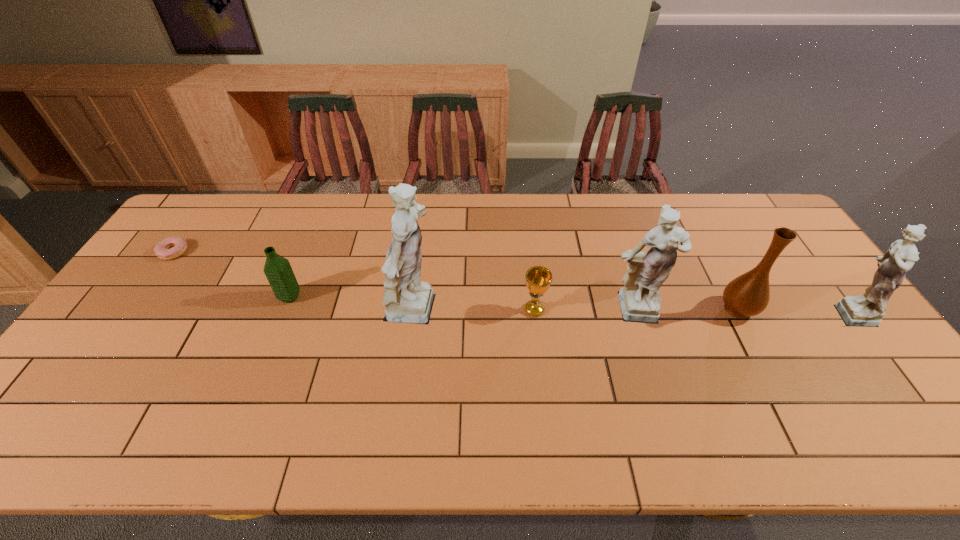
Locate an element on the screen. the second shortest object is located at coordinates (538, 278).

At what (x,y) coordinates should I click in order to perform the action: click on the fourth object from right to left. Please return your answer as a coordinate pair (x, y). The width and height of the screenshot is (960, 540). Looking at the image, I should click on (538, 278).

The image size is (960, 540). Find the location of `vacant area situated 0.260m on the front-facing side of the third object from left to right`. vacant area situated 0.260m on the front-facing side of the third object from left to right is located at coordinates (542, 314).

Locate an element on the screen. free spot located on the front-facing side of the second figurine from left to right is located at coordinates (654, 381).

I want to click on free spot located on the front-facing side of the rightmost object, so click(710, 312).

Locate an element on the screen. free space located 0.270m on the front-facing side of the rightmost object is located at coordinates (729, 312).

Locate an element on the screen. This screenshot has width=960, height=540. vacant space located 0.110m on the front-facing side of the rightmost object is located at coordinates tap(785, 312).

Where is `free space located on the left of the fifth tallest object`? The width and height of the screenshot is (960, 540). free space located on the left of the fifth tallest object is located at coordinates (207, 297).

The width and height of the screenshot is (960, 540). Find the location of `free space located 0.340m on the front of the doughnut`. free space located 0.340m on the front of the doughnut is located at coordinates coord(101,353).

The height and width of the screenshot is (540, 960). Find the location of `vacant space located on the right of the vase`. vacant space located on the right of the vase is located at coordinates (782, 309).